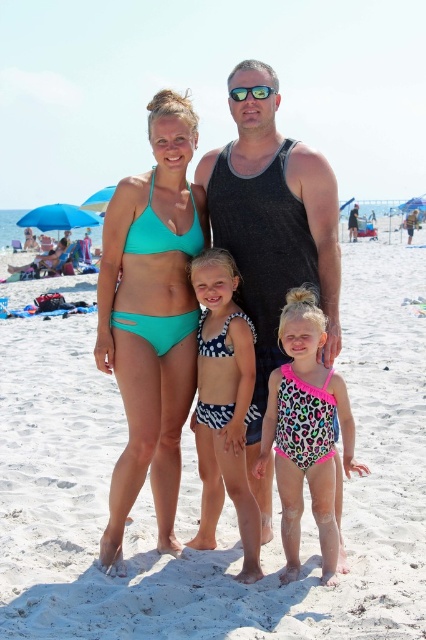
Question: Among these objects, which one is nearest to the camera?

Choices:
 (A) black tank top at center
 (B) pink leopard print swimsuit at center
 (C) white sand at center

Answer: (C)

Question: Can you confirm if teal bikini top at center is thinner than polka dot swimsuit at center?

Choices:
 (A) no
 (B) yes

Answer: (A)

Question: Which point is closer to the camera?

Choices:
 (A) teal bikini top at center
 (B) black tank top at center
 (C) green plastic sunglasses at center

Answer: (A)

Question: Is polka dot swimsuit at center bigger than green plastic sunglasses at center?

Choices:
 (A) no
 (B) yes

Answer: (B)

Question: Can you confirm if teal bikini top at center is smaller than green plastic sunglasses at center?

Choices:
 (A) no
 (B) yes

Answer: (A)

Question: Among these points, which one is nearest to the camera?

Choices:
 (A) (198, 531)
 (B) (253, 161)
 (C) (259, 93)
 (D) (161, 189)

Answer: (A)